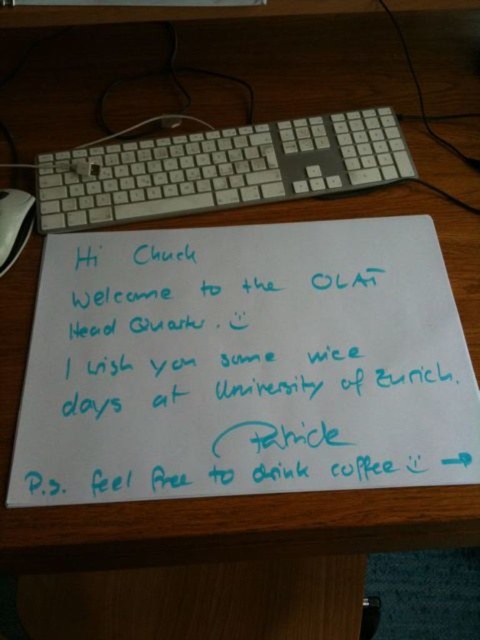
You are setting up a new monitor on the desk. The monitor stand requires that the object underneath it must be taller than 3 cm. Can the white plastic keyboard at upper center or the black plastic mouse at lower left support the monitor stand?

The white plastic keyboard at upper center has a greater height compared to the black plastic mouse at lower left. Since the keyboard is taller, it is more likely to meet the monitor stand requirement of being taller than 3 cm. The mouse is shorter, so it might not be suitable. Therefore, the white plastic keyboard at upper center can support the monitor stand.

You are organizing the desk and need to place a new item between the white plastic keyboard at upper center and the black plastic mouse at lower left. Based on their current positions, where should you place the item to ensure it is between them?

The white plastic keyboard at upper center is positioned on the right side of black plastic mouse at lower left, so to place an item between them, it should be placed to the right of the black plastic mouse at lower left and to the left of the white plastic keyboard at upper center.